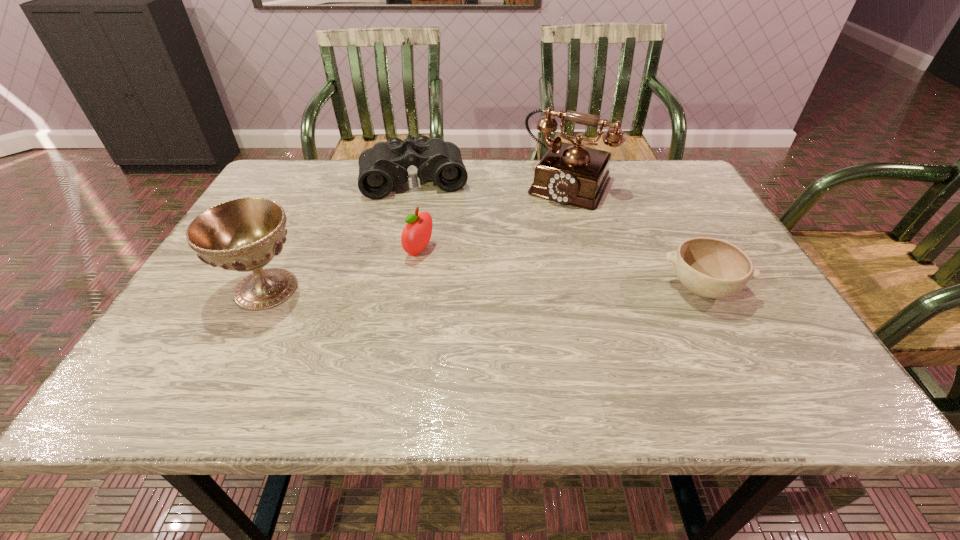
The height and width of the screenshot is (540, 960). Find the location of `telephone at the far edge`. telephone at the far edge is located at coordinates (572, 174).

Where is `object present at the left edge`? The image size is (960, 540). object present at the left edge is located at coordinates (245, 234).

Where is `object that is at the right edge`? The height and width of the screenshot is (540, 960). object that is at the right edge is located at coordinates (712, 268).

Where is `free space at the far edge`? The width and height of the screenshot is (960, 540). free space at the far edge is located at coordinates (476, 175).

What are the coordinates of `vacant space at the left edge` in the screenshot? It's located at (286, 248).

The width and height of the screenshot is (960, 540). In order to click on vacant space at the far right corner of the desktop in this screenshot , I will do pos(664,191).

What are the coordinates of `empty space that is in between the fourth object from left to right and the apple` in the screenshot? It's located at (x=493, y=217).

Locate an element on the screen. vacant space that is in between the binoculars and the tallest object is located at coordinates (492, 181).

The image size is (960, 540). Identify the location of free space between the apple and the leftmost object. tap(343, 270).

Locate an element on the screen. free space between the rightmost object and the tallest object is located at coordinates (635, 235).